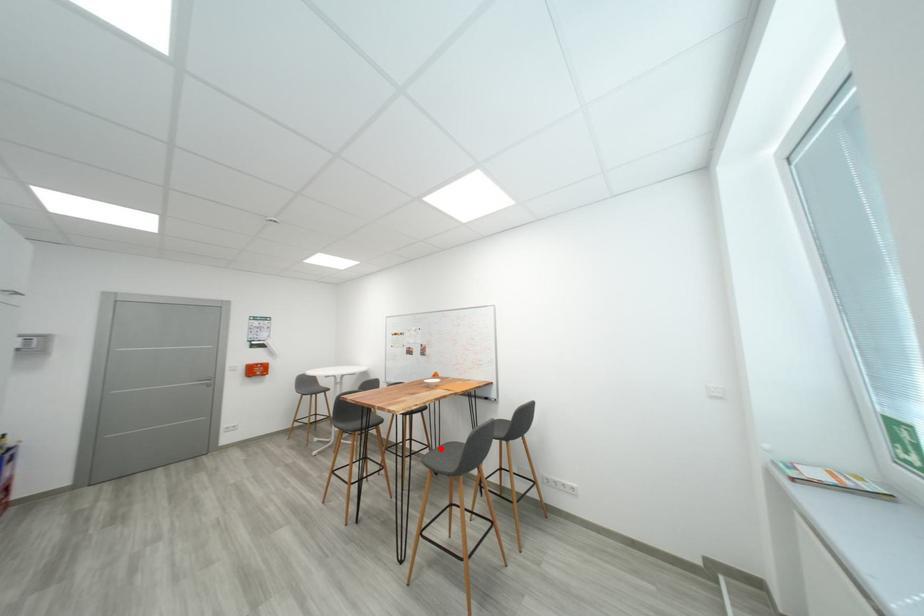
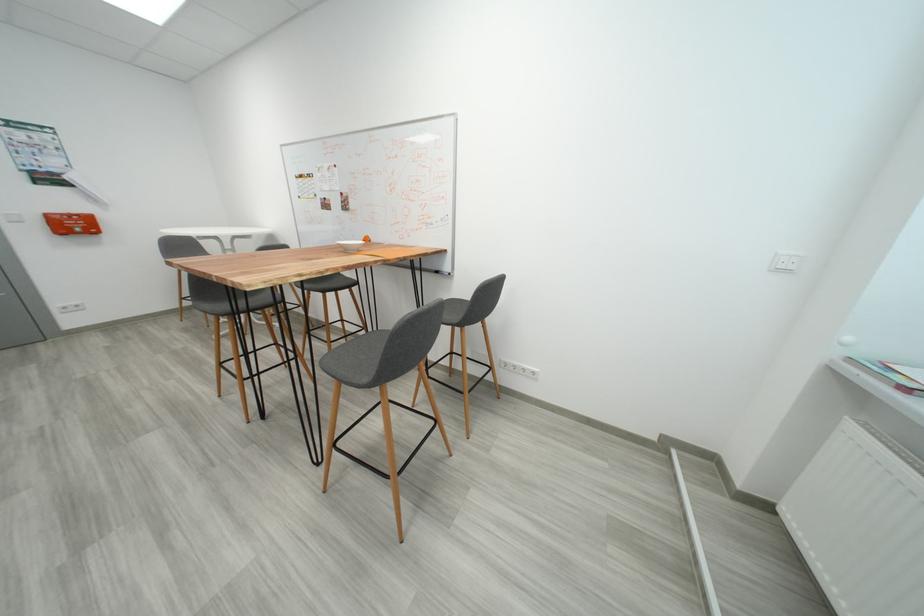
Find the pixel in the second image that matches the highlighted location in the first image.

(377, 331)